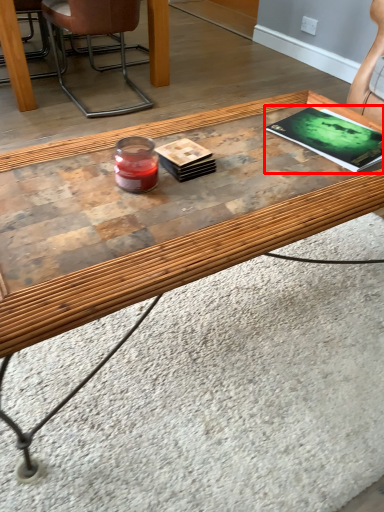
Question: From the image's perspective, where is magazine (annotated by the red box) located in relation to chair in the image?

Choices:
 (A) above
 (B) below

Answer: (B)